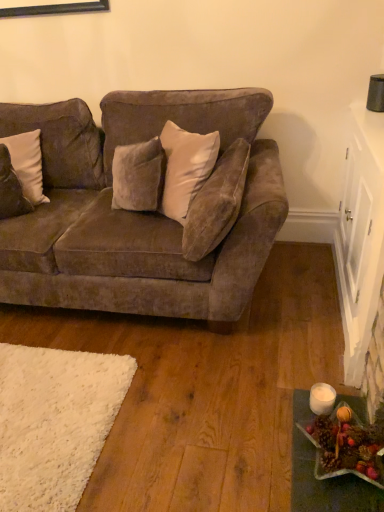
Identify the location of white velvet pillow at left, acting as the first pillow starting from the left. This screenshot has width=384, height=512. click(x=27, y=164).

What is the approximate height of velvet brown couch at left?

velvet brown couch at left is 38.27 inches tall.

What do you see at coordinates (347, 446) in the screenshot? I see `shiny metallic star at lower right` at bounding box center [347, 446].

This screenshot has height=512, width=384. I want to click on white velvet pillow at left, the second pillow positioned from the right, so click(27, 164).

From the image's perspective, between shiny metallic star at lower right and white velvet pillow at left, acting as the first pillow starting from the left, who is located below?

From the image's view, shiny metallic star at lower right is below.

How many degrees apart are the facing directions of shiny metallic star at lower right and white velvet pillow at left, acting as the first pillow starting from the left?

105 degrees separate the facing orientations of shiny metallic star at lower right and white velvet pillow at left, acting as the first pillow starting from the left.

Is shiny metallic star at lower right not inside white velvet pillow at left, acting as the first pillow starting from the left?

shiny metallic star at lower right is positioned outside white velvet pillow at left, acting as the first pillow starting from the left.

From a real-world perspective, which is physically above, shiny metallic star at lower right or white velvet pillow at left, the second pillow positioned from the right?

From a 3D spatial view, white velvet pillow at left, the second pillow positioned from the right, is above.

Does velvet brown couch at left have a smaller size compared to velvet beige pillow at center, the 1th pillow in the right-to-left sequence?

Actually, velvet brown couch at left might be larger than velvet beige pillow at center, the 1th pillow in the right-to-left sequence.

Can you confirm if velvet brown couch at left is thinner than velvet beige pillow at center, which is the second pillow from left to right?

No, velvet brown couch at left is not thinner than velvet beige pillow at center, which is the second pillow from left to right.

From the image's perspective, between velvet brown couch at left and velvet beige pillow at center, which is the second pillow from left to right, who is located below?

velvet beige pillow at center, which is the second pillow from left to right.

From a real-world perspective, does velvet brown couch at left sit lower than velvet beige pillow at center, the 1th pillow in the right-to-left sequence?

Result: Correct, in the physical world, velvet brown couch at left is lower than velvet beige pillow at center, the 1th pillow in the right-to-left sequence.

Looking at their sizes, would you say white velvet pillow at left, the second pillow positioned from the right, is wider or thinner than shiny metallic star at lower right?

Clearly, white velvet pillow at left, the second pillow positioned from the right, has less width compared to shiny metallic star at lower right.

Between white velvet pillow at left, acting as the first pillow starting from the left, and shiny metallic star at lower right, which one has larger size?

white velvet pillow at left, acting as the first pillow starting from the left.

At what (x,y) coordinates should I click in order to perform the action: click on the 2nd pillow to the left of the shiny metallic star at lower right, counting from the anchor's position. Please return your answer as a coordinate pair (x, y). Image resolution: width=384 pixels, height=512 pixels. Looking at the image, I should click on (27, 164).

Measure the distance from white velvet pillow at left, acting as the first pillow starting from the left, to shiny metallic star at lower right.

white velvet pillow at left, acting as the first pillow starting from the left, and shiny metallic star at lower right are 1.82 meters apart.

From the image's perspective, does white velvet pillow at left, acting as the first pillow starting from the left, appear lower than velvet brown couch at left?

No, from the image's perspective, white velvet pillow at left, acting as the first pillow starting from the left, is not beneath velvet brown couch at left.

Measure the distance between white velvet pillow at left, the second pillow positioned from the right, and velvet brown couch at left.

19.25 inches.

Between white velvet pillow at left, acting as the first pillow starting from the left, and velvet brown couch at left, which one has larger width?

velvet brown couch at left.

Is velvet brown couch at left at the back of white velvet pillow at left, acting as the first pillow starting from the left?

Yes, white velvet pillow at left, acting as the first pillow starting from the left, is positioned with its back facing velvet brown couch at left.

Where is `food that is under the velvet beige pillow at center, the 1th pillow in the right-to-left sequence (from a real-world perspective)`? The image size is (384, 512). food that is under the velvet beige pillow at center, the 1th pillow in the right-to-left sequence (from a real-world perspective) is located at coordinates click(x=347, y=446).

Does shiny metallic star at lower right have a larger size compared to velvet beige pillow at center, the 1th pillow in the right-to-left sequence?

No, shiny metallic star at lower right is not bigger than velvet beige pillow at center, the 1th pillow in the right-to-left sequence.

From the image's perspective, which object appears higher, shiny metallic star at lower right or velvet beige pillow at center, which is the second pillow from left to right?

velvet beige pillow at center, which is the second pillow from left to right, is shown above in the image.

In the scene shown: Can you tell me how much shiny metallic star at lower right and velvet beige pillow at center, which is the second pillow from left to right, differ in facing direction?

shiny metallic star at lower right and velvet beige pillow at center, which is the second pillow from left to right, are facing 0.441 degrees away from each other.

Considering the sizes of velvet beige pillow at center, which is the second pillow from left to right, and velvet brown couch at left in the image, is velvet beige pillow at center, which is the second pillow from left to right, wider or thinner than velvet brown couch at left?

Considering their sizes, velvet beige pillow at center, which is the second pillow from left to right, looks slimmer than velvet brown couch at left.

The width and height of the screenshot is (384, 512). I want to click on studio couch located above the velvet beige pillow at center, the 1th pillow in the right-to-left sequence (from the image's perspective), so click(x=136, y=212).

Is velvet beige pillow at center, which is the second pillow from left to right, looking in the opposite direction of velvet brown couch at left?

Yes.

From a real-world perspective, between shiny metallic star at lower right and velvet brown couch at left, who is vertically lower?

shiny metallic star at lower right is physically lower.

Which is further, (333, 437) or (50, 293)?

The point (50, 293) is behind.

Locate an element on the screen. This screenshot has width=384, height=512. studio couch behind the shiny metallic star at lower right is located at coordinates (136, 212).

Find the location of `the 2nd pillow positioned above the shiny metallic star at lower right (from a real-world perspective)`. the 2nd pillow positioned above the shiny metallic star at lower right (from a real-world perspective) is located at coordinates (27, 164).

The image size is (384, 512). I want to click on studio couch above the velvet beige pillow at center, which is the second pillow from left to right (from the image's perspective), so click(x=136, y=212).

When comparing their distances from shiny metallic star at lower right, does white velvet pillow at left, the second pillow positioned from the right, or velvet beige pillow at center, which is the second pillow from left to right, seem closer?

velvet beige pillow at center, which is the second pillow from left to right, is closer to shiny metallic star at lower right.

Considering their positions, is velvet brown couch at left positioned closer to shiny metallic star at lower right than white velvet pillow at left, the second pillow positioned from the right?

velvet brown couch at left.

From the image, which object appears to be nearer to white velvet pillow at left, the second pillow positioned from the right, velvet brown couch at left or shiny metallic star at lower right?

velvet brown couch at left lies closer to white velvet pillow at left, the second pillow positioned from the right, than the other object.

From the image, which object appears to be farther from velvet brown couch at left, white velvet pillow at left, acting as the first pillow starting from the left, or shiny metallic star at lower right?

The object further to velvet brown couch at left is shiny metallic star at lower right.

Based on the photo, from the image, which object appears to be farther from velvet brown couch at left, shiny metallic star at lower right or velvet beige pillow at center, the 1th pillow in the right-to-left sequence?

Based on the image, shiny metallic star at lower right appears to be further to velvet brown couch at left.

From the image, which object appears to be nearer to shiny metallic star at lower right, white velvet pillow at left, the second pillow positioned from the right, or velvet brown couch at left?

velvet brown couch at left lies closer to shiny metallic star at lower right than the other object.

From the picture: Considering their positions, is shiny metallic star at lower right positioned closer to white velvet pillow at left, the second pillow positioned from the right, than velvet beige pillow at center, the 1th pillow in the right-to-left sequence?

The object closer to white velvet pillow at left, the second pillow positioned from the right, is velvet beige pillow at center, the 1th pillow in the right-to-left sequence.

Estimate the real-world distances between objects in this image. Which object is closer to shiny metallic star at lower right, velvet beige pillow at center, the 1th pillow in the right-to-left sequence, or velvet brown couch at left?

velvet beige pillow at center, the 1th pillow in the right-to-left sequence, is closer to shiny metallic star at lower right.

You are a GUI agent. You are given a task and a screenshot of the screen. Output one action in this format:
    pyautogui.click(x=<x>, y=<y>)
    Task: Click on the studio couch located between white velvet pillow at left, the second pillow positioned from the right, and velvet beige pillow at center, the 1th pillow in the right-to-left sequence, in the left-right direction
    This screenshot has height=512, width=384.
    Given the screenshot: What is the action you would take?
    pyautogui.click(x=136, y=212)

You are a GUI agent. You are given a task and a screenshot of the screen. Output one action in this format:
    pyautogui.click(x=<x>, y=<y>)
    Task: Click on the pillow located between white velvet pillow at left, acting as the first pillow starting from the left, and shiny metallic star at lower right in the left-right direction
    Image resolution: width=384 pixels, height=512 pixels.
    Given the screenshot: What is the action you would take?
    pyautogui.click(x=216, y=203)

Where is `pillow located between velvet brown couch at left and shiny metallic star at lower right in the left-right direction`? This screenshot has width=384, height=512. pillow located between velvet brown couch at left and shiny metallic star at lower right in the left-right direction is located at coordinates (216, 203).

Locate an element on the screen. studio couch between white velvet pillow at left, acting as the first pillow starting from the left, and shiny metallic star at lower right from left to right is located at coordinates (136, 212).